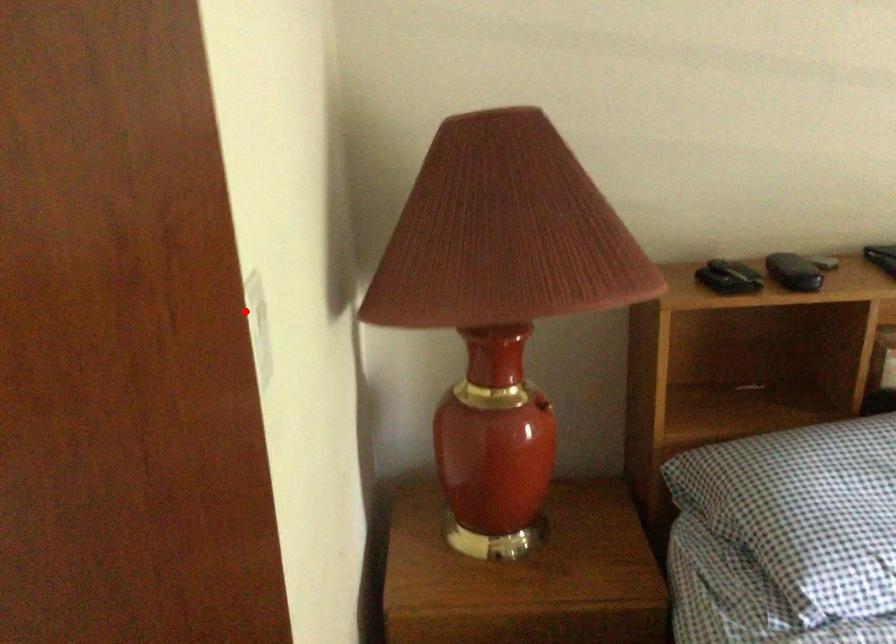
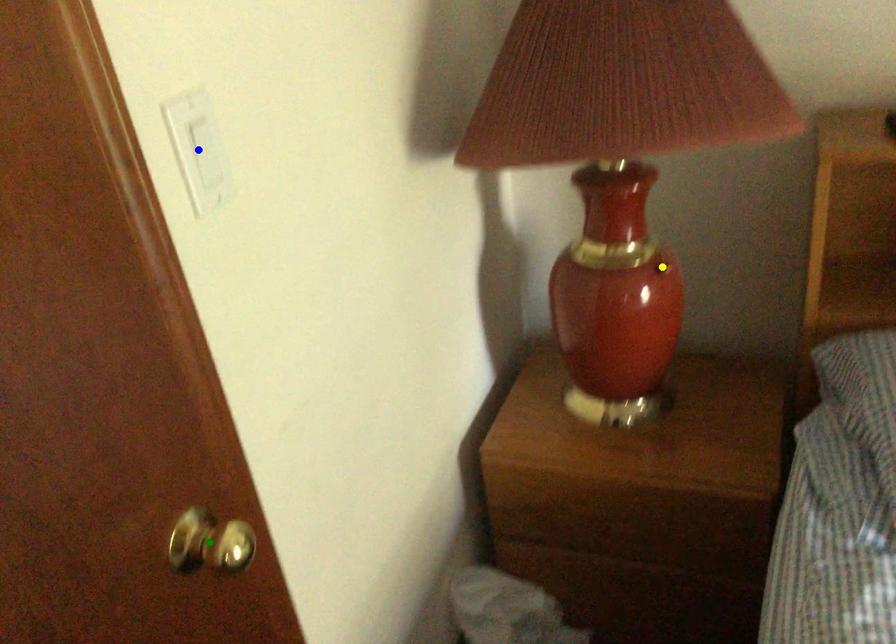
Question: I am providing you with two images of the same scene from different viewpoints. A red point is marked on the first image. You are given multiple points on the second image. Which mark in image 2 goes with the point in image 1?

Choices:
 (A) blue point
 (B) yellow point
 (C) green point

Answer: (A)